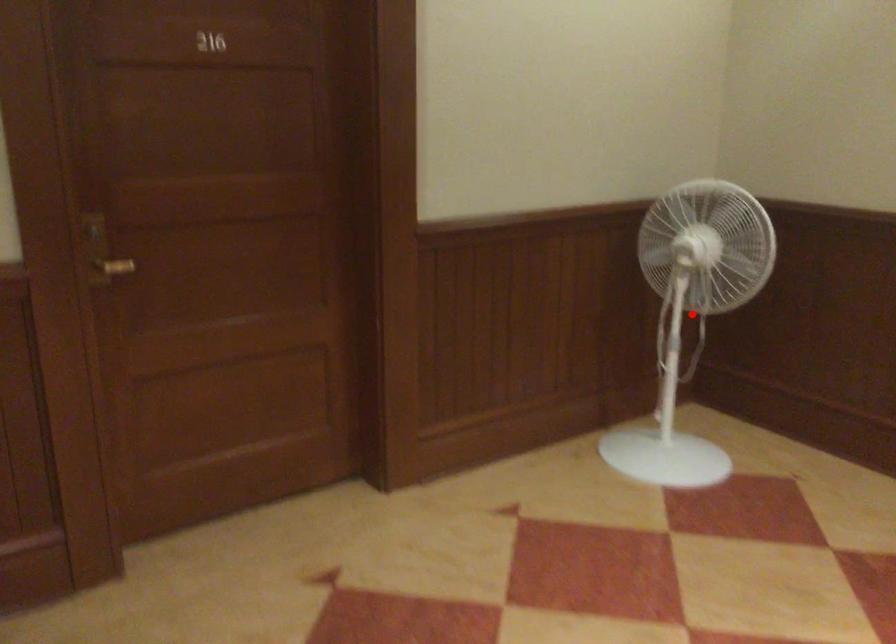
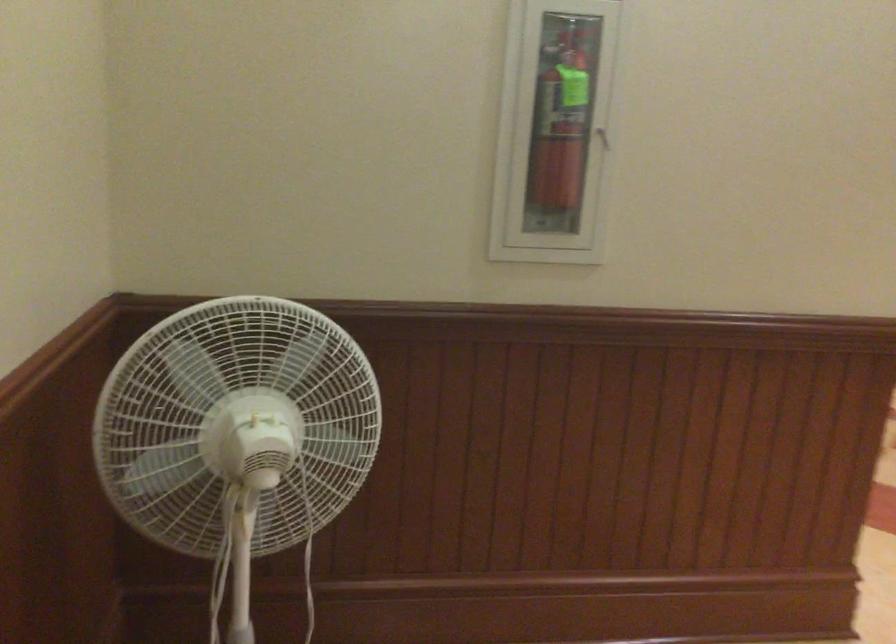
Question: I am providing you with two images of the same scene from different viewpoints. A red point is marked on the first image. Is the red point's position out of view in image 2?

Choices:
 (A) Yes
 (B) No

Answer: (A)